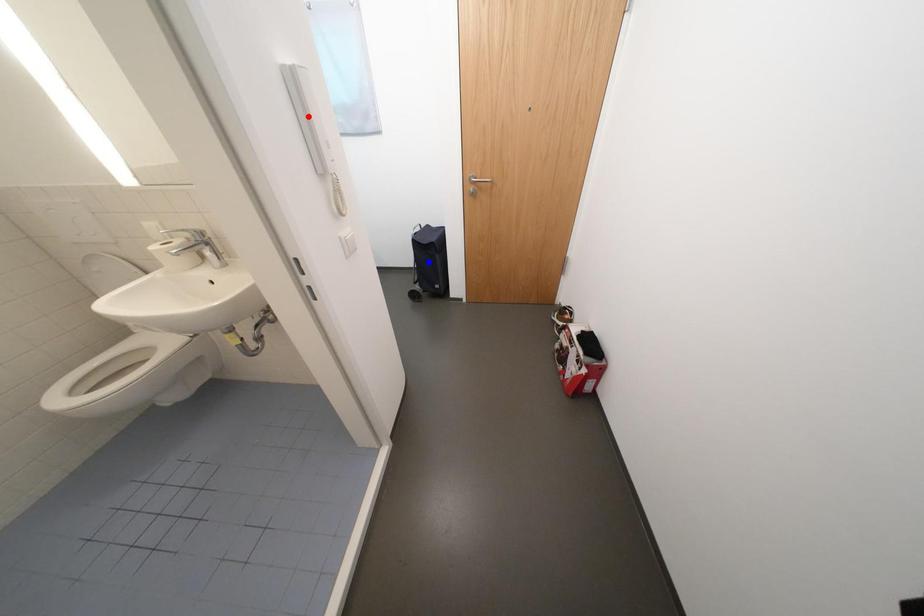
Question: Two points are marked on the image. Which point is closer to the camera?

Choices:
 (A) Blue point is closer.
 (B) Red point is closer.

Answer: (B)